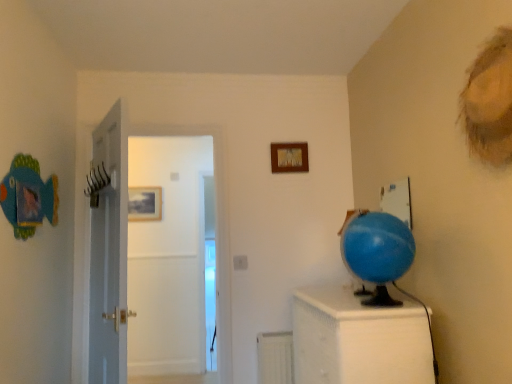
Question: Is wooden picture frame at upper center, which appears as the 2th picture frame when ordered from the bottom, at the left side of white glossy door at center?

Choices:
 (A) no
 (B) yes

Answer: (A)

Question: Can you confirm if wooden picture frame at upper center, the 1th picture frame viewed from the top, is thinner than white glossy door at center?

Choices:
 (A) yes
 (B) no

Answer: (A)

Question: Is wooden picture frame at upper center, which ranks as the first picture frame in front-to-back order, in front of white glossy door at center?

Choices:
 (A) no
 (B) yes

Answer: (A)

Question: Are wooden picture frame at upper center, the 1th picture frame viewed from the top, and white glossy door at center making contact?

Choices:
 (A) yes
 (B) no

Answer: (B)

Question: Is there a large distance between wooden picture frame at upper center, acting as the second picture frame starting from the back, and white glossy door at center?

Choices:
 (A) no
 (B) yes

Answer: (B)

Question: Does wooden picture frame at upper center, acting as the second picture frame starting from the back, have a larger size compared to white glossy door at center?

Choices:
 (A) yes
 (B) no

Answer: (B)

Question: Considering the relative positions of wooden picture frame at upper center, which appears as the first picture frame when viewed from the right, and white matte radiator at lower center in the image provided, is wooden picture frame at upper center, which appears as the first picture frame when viewed from the right, to the left of white matte radiator at lower center from the viewer's perspective?

Choices:
 (A) yes
 (B) no

Answer: (B)

Question: Is wooden picture frame at upper center, acting as the second picture frame starting from the back, far from white matte radiator at lower center?

Choices:
 (A) no
 (B) yes

Answer: (B)

Question: Can you confirm if wooden picture frame at upper center, which appears as the first picture frame when viewed from the right, is bigger than white matte radiator at lower center?

Choices:
 (A) no
 (B) yes

Answer: (A)

Question: Is wooden picture frame at upper center, the 1th picture frame viewed from the top, facing towards white matte radiator at lower center?

Choices:
 (A) yes
 (B) no

Answer: (B)

Question: Can you confirm if wooden picture frame at upper center, the 2th picture frame in the left-to-right sequence, is taller than white matte radiator at lower center?

Choices:
 (A) no
 (B) yes

Answer: (A)

Question: From a real-world perspective, is wooden picture frame at upper center, the 2th picture frame in the left-to-right sequence, over white matte radiator at lower center?

Choices:
 (A) yes
 (B) no

Answer: (A)

Question: Considering the relative sizes of white textured cabinet at right and wooden picture frame at upper center, acting as the second picture frame starting from the back, in the image provided, is white textured cabinet at right smaller than wooden picture frame at upper center, acting as the second picture frame starting from the back,?

Choices:
 (A) no
 (B) yes

Answer: (A)